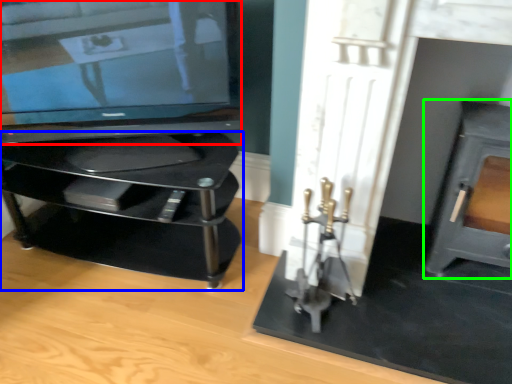
Question: Estimate the real-world distances between objects in this image. Which object is farther from television (highlighted by a red box), furniture (highlighted by a blue box) or fireplace (highlighted by a green box)?

Choices:
 (A) furniture
 (B) fireplace

Answer: (B)